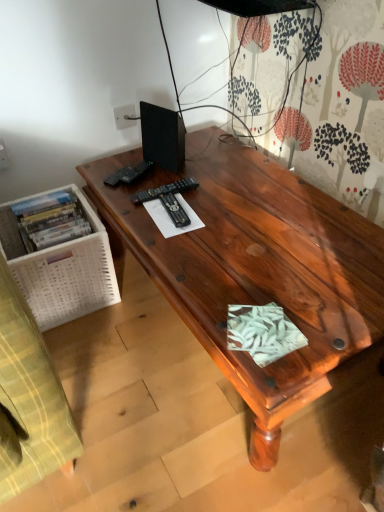
Where is `free space in front of black plastic remote control at upper left, marked as the third remote control in a front-to-back arrangement`? The image size is (384, 512). free space in front of black plastic remote control at upper left, marked as the third remote control in a front-to-back arrangement is located at coordinates (135, 198).